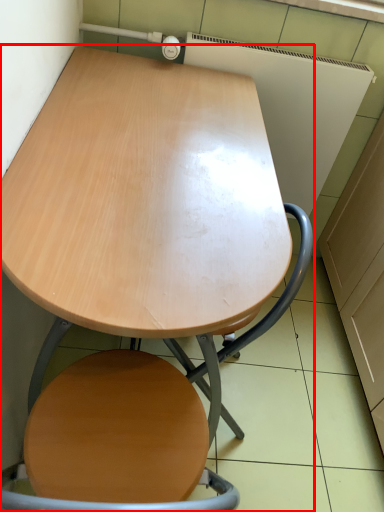
Question: From the image's perspective, what is the correct spatial relationship of table (annotated by the red box) in relation to swivel chair?

Choices:
 (A) below
 (B) above

Answer: (B)